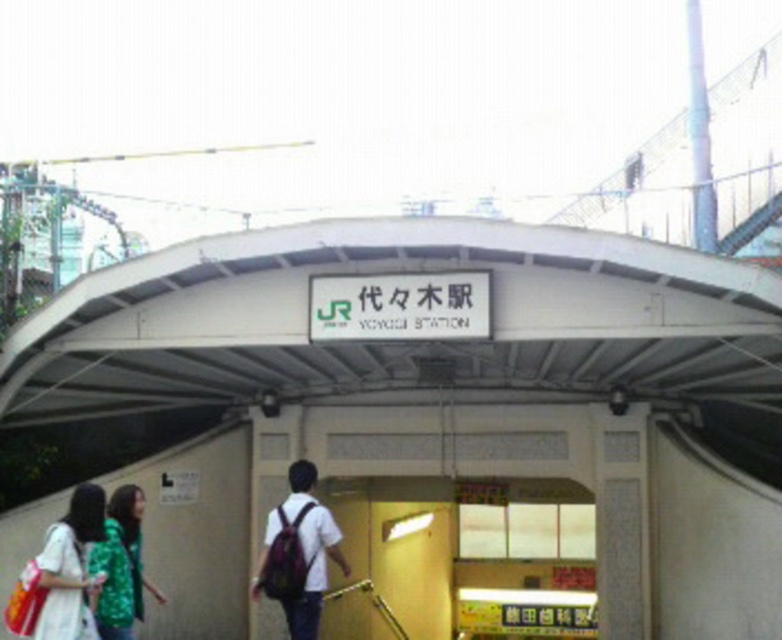
Is matte white shirt with backpack at center positioned at the back of green textured jacket at lower left?

Yes, it is behind green textured jacket at lower left.

Who is more forward, (339, 557) or (95, 625)?

Point (95, 625) is in front.

This screenshot has width=782, height=640. In order to click on matte white shirt with backpack at center in this screenshot , I will do `click(310, 548)`.

Does point (303, 362) lie in front of point (311, 547)?

No, it is behind (311, 547).

Between white matte overpass at center and matte white shirt with backpack at center, which one has more height?

white matte overpass at center is taller.

Between point (680, 291) and point (293, 609), which one is positioned behind?

The point (293, 609) is more distant.

What are the coordinates of `white matte overpass at center` in the screenshot? It's located at (396, 339).

Can you confirm if white matte overpass at center is smaller than green textured jacket at lower left?

No, white matte overpass at center is not smaller than green textured jacket at lower left.

Is point (257, 237) positioned behind point (106, 554)?

Yes, point (257, 237) is behind point (106, 554).

Who is more distant from viewer, (x=508, y=378) or (x=99, y=630)?

Positioned behind is point (x=508, y=378).

This screenshot has height=640, width=782. In order to click on white matte overpass at center in this screenshot , I will do `click(396, 339)`.